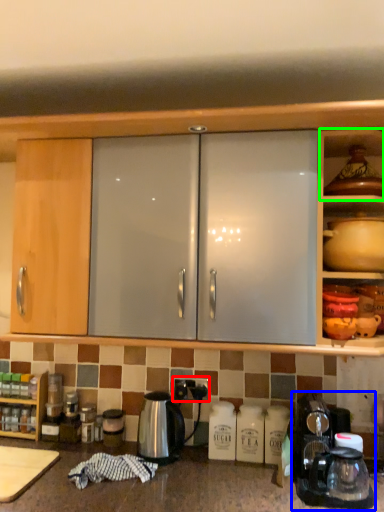
Question: Which is farther away from electric outlet (highlighted by a red box)? coffee machine (highlighted by a blue box) or shelf (highlighted by a green box)?

Choices:
 (A) coffee machine
 (B) shelf

Answer: (B)